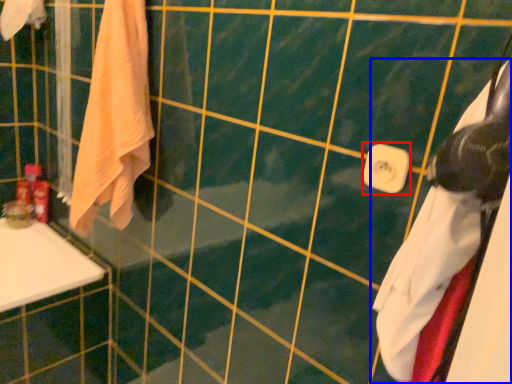
Question: Which point is further to the camera, towel bar (highlighted by a red box) or towel (highlighted by a blue box)?

Choices:
 (A) towel bar
 (B) towel

Answer: (A)